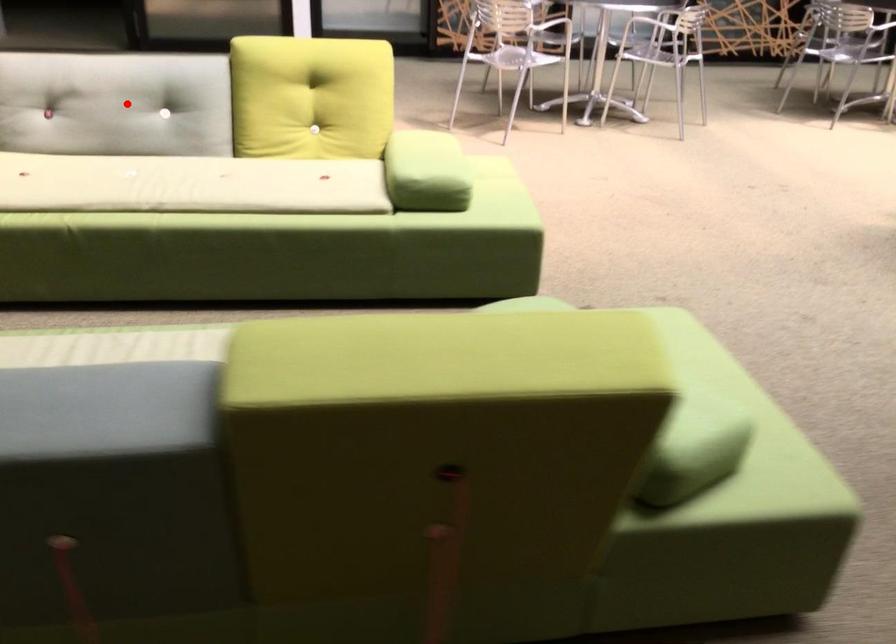
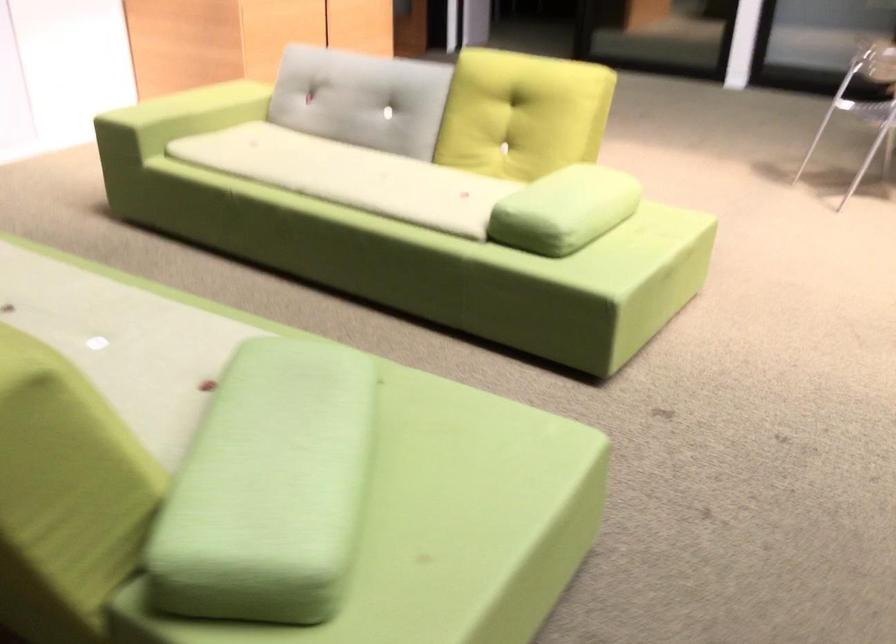
Question: I am providing you with two images of the same scene from different viewpoints. Given a red point in image1, look at the same physical point in image2. Is it:

Choices:
 (A) Closer to the viewpoint
 (B) Farther from the viewpoint

Answer: (B)